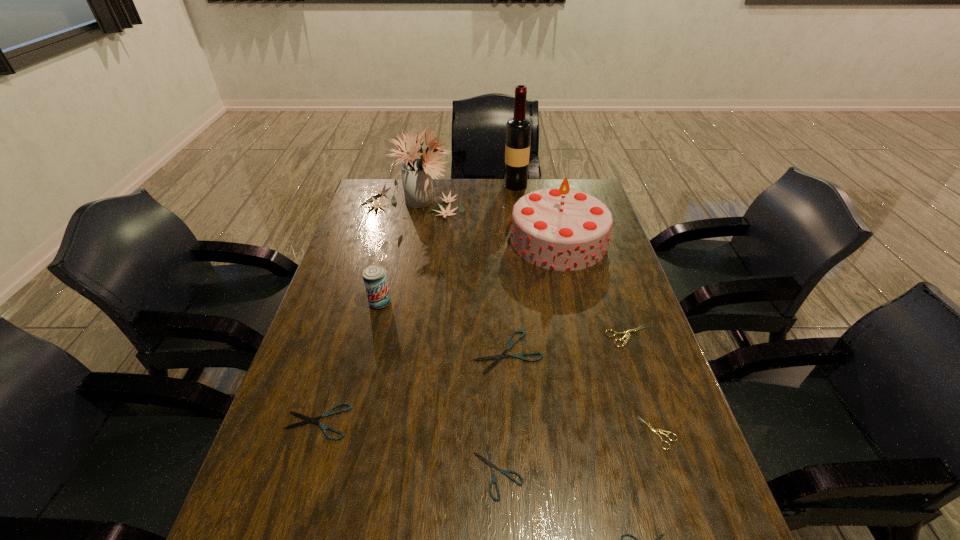
Where is `the smaller beige shears`? the smaller beige shears is located at coordinates (655, 431).

What are the coordinates of `the second smallest black shears` in the screenshot? It's located at (491, 463).

I want to click on free space located 0.370m on the front of the wine bottle, so click(x=523, y=247).

Where is `free region located on the right of the bouquet`? free region located on the right of the bouquet is located at coordinates (484, 202).

What are the coordinates of `free space located 0.080m on the front of the birthday cake` in the screenshot? It's located at (569, 289).

At what (x,y) coordinates should I click in order to perform the action: click on free space located on the right of the fourth farthest object. Please return your answer as a coordinate pair (x, y). This screenshot has height=540, width=960. Looking at the image, I should click on (453, 302).

In order to click on free space located on the front of the farthest black shears in this screenshot , I will do `click(511, 396)`.

The height and width of the screenshot is (540, 960). Find the location of `free space located on the back of the farther beige shears`. free space located on the back of the farther beige shears is located at coordinates (603, 261).

This screenshot has height=540, width=960. What are the coordinates of `free space located on the right of the second farthest black shears` in the screenshot? It's located at (447, 421).

What are the coordinates of `free location located 0.320m on the left of the smaller beige shears` in the screenshot? It's located at (494, 433).